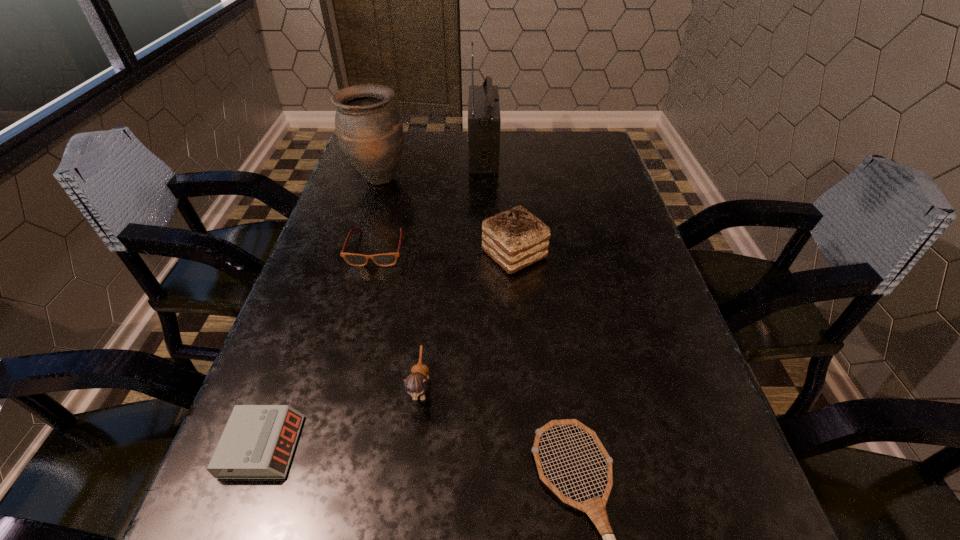
Where is `object present at the far left corner`? object present at the far left corner is located at coordinates (369, 129).

Where is `free space at the far edge of the desktop`? The width and height of the screenshot is (960, 540). free space at the far edge of the desktop is located at coordinates (545, 140).

Find the location of a particular element. free space at the left edge of the desktop is located at coordinates (385, 224).

At what (x,y) coordinates should I click in order to perform the action: click on free space at the right edge of the desktop. Please return your answer as a coordinate pair (x, y). The width and height of the screenshot is (960, 540). Looking at the image, I should click on (623, 192).

Where is `free space between the second tallest object and the fifth farthest object`? Image resolution: width=960 pixels, height=540 pixels. free space between the second tallest object and the fifth farthest object is located at coordinates (399, 282).

Where is `vacant area between the sixth shortest object and the alarm clock`? This screenshot has height=540, width=960. vacant area between the sixth shortest object and the alarm clock is located at coordinates (321, 313).

Where is `vacant area between the alarm clock and the fourth tallest object`? This screenshot has height=540, width=960. vacant area between the alarm clock and the fourth tallest object is located at coordinates (342, 416).

At what (x,y) coordinates should I click in order to perform the action: click on free spot between the third tallest object and the fourth tallest object. Please return your answer as a coordinate pair (x, y). This screenshot has height=540, width=960. Looking at the image, I should click on (468, 320).

Where is `free space between the spectacles and the urn`? free space between the spectacles and the urn is located at coordinates (377, 214).

Identify the location of vacant region between the third tallest object and the kitten. (468, 320).